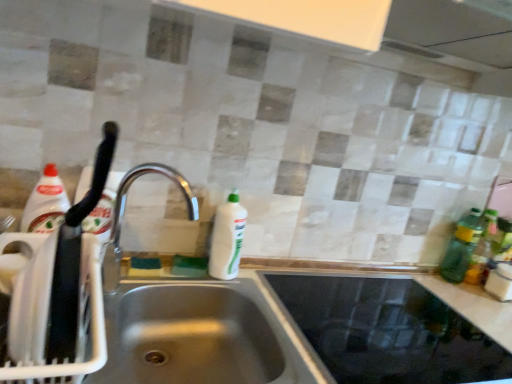
Question: From a real-world perspective, is green translucent bottle at right, positioned as the 1th bottle in left-to-right order, physically located above or below stainless steel sink at lower left?

Choices:
 (A) above
 (B) below

Answer: (A)

Question: From the image's perspective, is green translucent bottle at right, arranged as the 2th bottle when viewed from the right, positioned above or below stainless steel sink at lower left?

Choices:
 (A) below
 (B) above

Answer: (B)

Question: Based on their relative distances, which object is farther from the white glossy bottle at center?

Choices:
 (A) white plastic dish rack at left
 (B) satin steel sink at center
 (C) green plastic bottle at right, arranged as the 1th bottle when viewed from the right
 (D) green translucent bottle at right, arranged as the 2th bottle when viewed from the right
 (E) stainless steel sink at lower left

Answer: (C)

Question: Which of these objects is positioned closest to the white plastic dish rack at left?

Choices:
 (A) satin steel sink at center
 (B) green translucent bottle at right, arranged as the 2th bottle when viewed from the right
 (C) silver metallic faucet at center
 (D) stainless steel sink at lower left
 (E) white glossy bottle at center

Answer: (C)